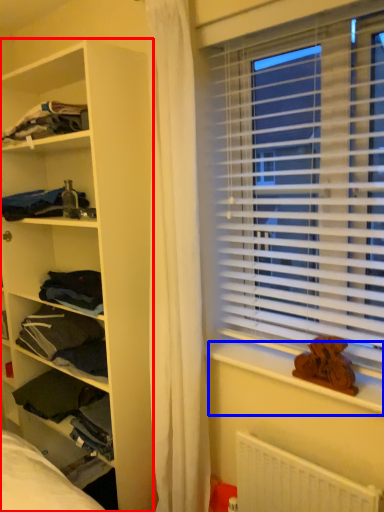
Question: Which object is further to the camera taking this photo, shelf (highlighted by a red box) or window sill (highlighted by a blue box)?

Choices:
 (A) shelf
 (B) window sill

Answer: (A)